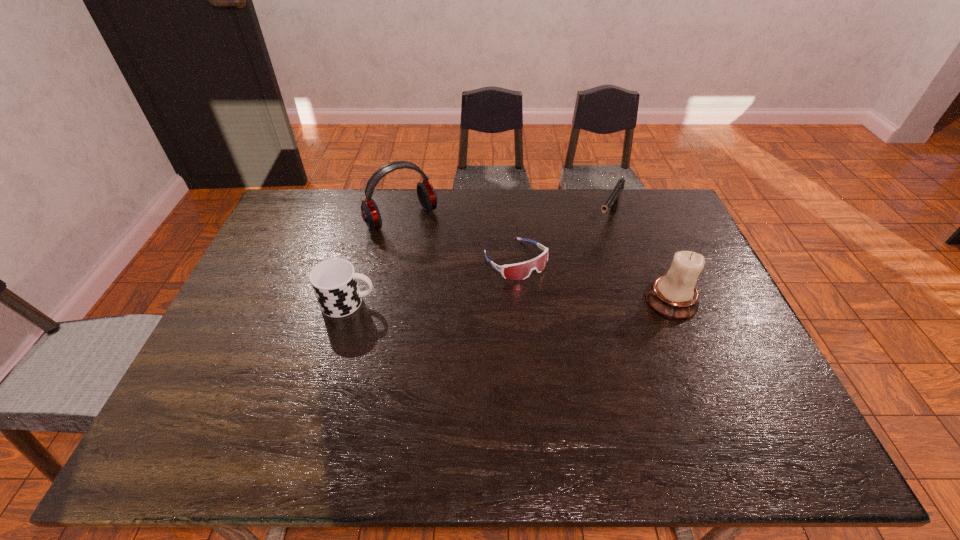
Identify the location of cup. This screenshot has height=540, width=960. (334, 281).

Identify the location of candle holder. (674, 295).

Find the location of a particular element. The height and width of the screenshot is (540, 960). earphone is located at coordinates (426, 193).

Identify the location of the third object from left to right. The height and width of the screenshot is (540, 960). (519, 271).

Find the location of a particular element. This screenshot has width=960, height=540. goggles is located at coordinates (519, 271).

You are a GUI agent. You are given a task and a screenshot of the screen. Output one action in this format:
    pyautogui.click(x=<x>, y=<y>)
    Task: Click on the pistol
    The width and height of the screenshot is (960, 540).
    Given the screenshot: What is the action you would take?
    pyautogui.click(x=613, y=200)

Where is `vacant space located 0.320m on the side of the cup with the handle`? vacant space located 0.320m on the side of the cup with the handle is located at coordinates (488, 302).

What are the coordinates of `free point located on the back of the candle holder` in the screenshot? It's located at (639, 224).

In order to click on vacant region located on the ear cups of the earphone in this screenshot , I will do `click(452, 278)`.

Locate an element on the screen. Image resolution: width=960 pixels, height=540 pixels. blank space located on the ear cups of the earphone is located at coordinates (442, 265).